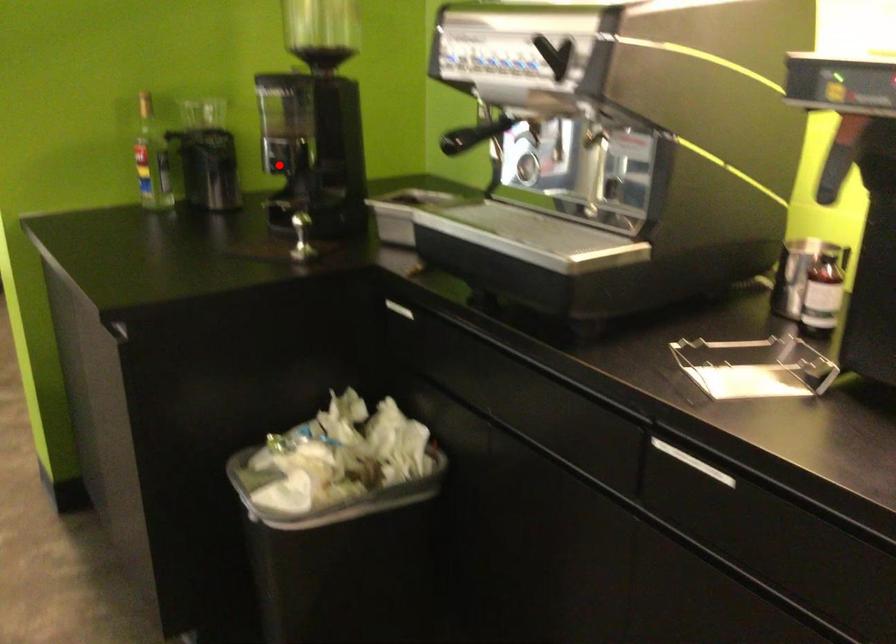
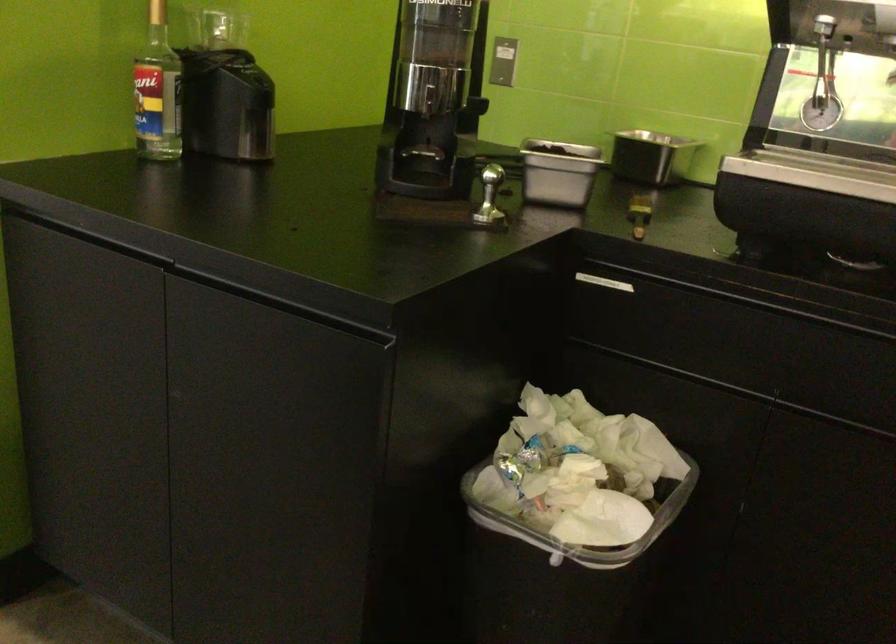
Find the pixel in the second image that matches the highlighted location in the first image.

(433, 100)